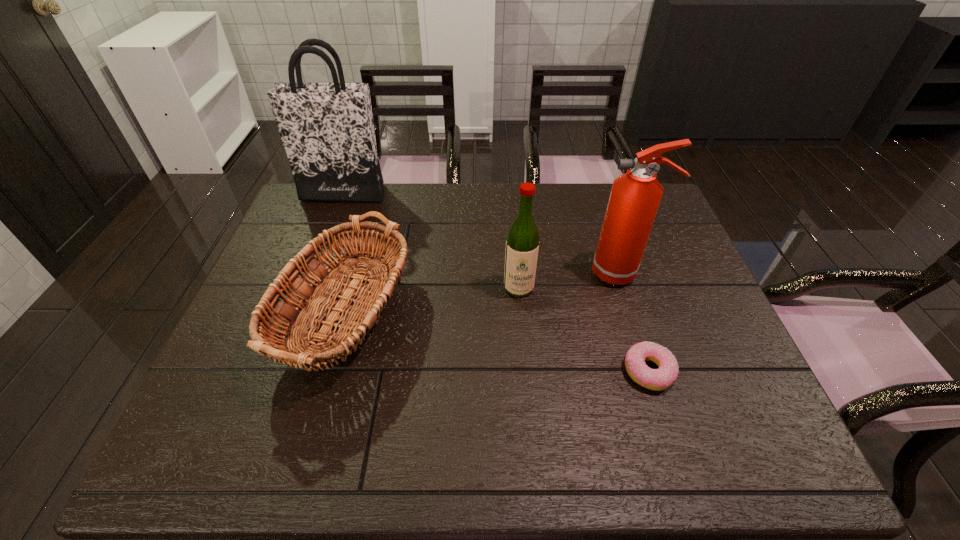
Where is `shopping bag`? This screenshot has width=960, height=540. shopping bag is located at coordinates (327, 129).

This screenshot has height=540, width=960. I want to click on the tallest object, so click(327, 129).

Where is `fire extinguisher`? fire extinguisher is located at coordinates (635, 196).

Find the location of a particular element. The image size is (960, 540). liquor is located at coordinates point(522,245).

Image resolution: width=960 pixels, height=540 pixels. Find the location of `the third tallest object`. the third tallest object is located at coordinates (522, 245).

Find the location of a particular element. The image size is (960, 540). basket is located at coordinates (370, 299).

Find the location of a particular element. The image size is (960, 540). doughnut is located at coordinates (662, 378).

Locate an element on the screen. This screenshot has height=540, width=960. vacant space positioned 0.190m on the front of the farthest object with the design is located at coordinates (325, 240).

You are a GUI agent. You are given a task and a screenshot of the screen. Output one action in this format:
    pyautogui.click(x=<x>, y=<y>)
    Task: Click on the blank space located 0.190m at the nozzle of the second tallest object
    
    Given the screenshot: What is the action you would take?
    click(x=523, y=273)

This screenshot has height=540, width=960. In order to click on vacant region located 0.290m at the nozzle of the second tallest object in this screenshot , I will do `click(489, 273)`.